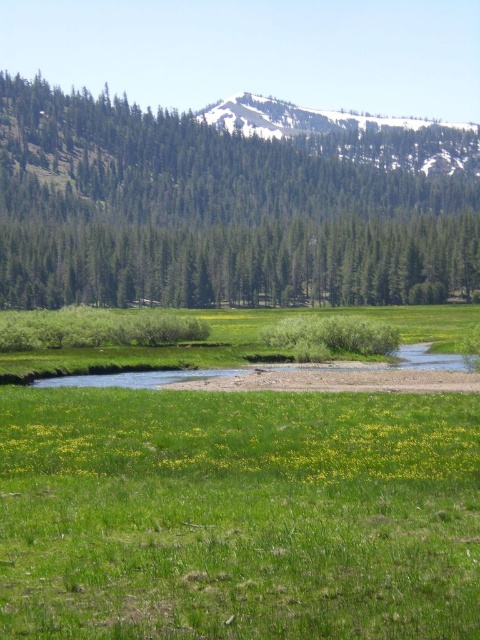
This screenshot has height=640, width=480. Describe the element at coordinates (212, 212) in the screenshot. I see `green textured trees at left` at that location.

Does green textured trees at left have a lesser width compared to green grassy field at lower center?

Incorrect, green textured trees at left's width is not less than green grassy field at lower center's.

This screenshot has width=480, height=640. In order to click on green textured trees at left in this screenshot , I will do `click(212, 212)`.